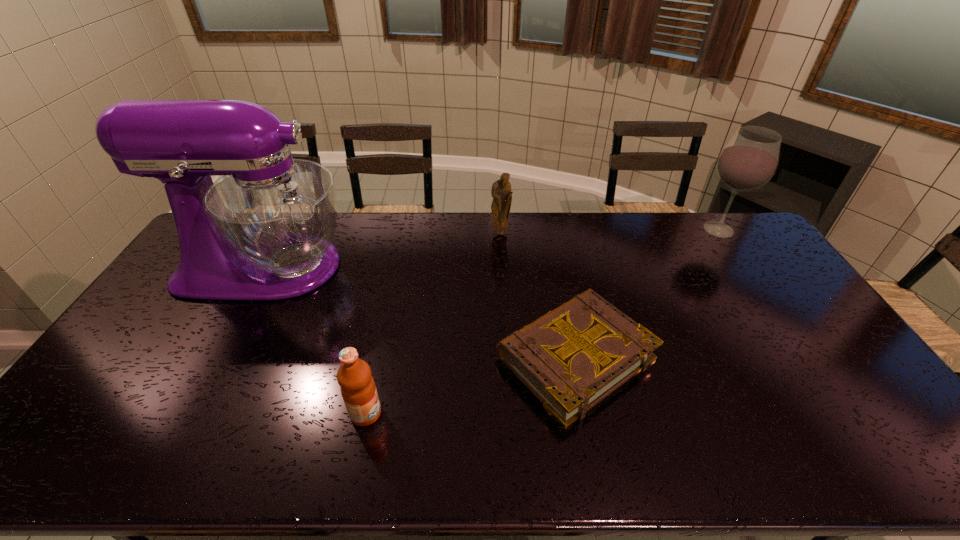
At what (x,y) coordinates should I click in order to perform the action: click on vacant point located between the alcohol and the figurine. Please return your answer as a coordinate pair (x, y). Looking at the image, I should click on (610, 232).

This screenshot has height=540, width=960. Find the location of `free space between the figurine and the hardback book`. free space between the figurine and the hardback book is located at coordinates (538, 295).

Identify which object is the third nearest to the fruit juice. Please provide its 2D coordinates. Your answer should be formatted as a tuple, i.e. [(x, y)], where the tuple contains the x and y coordinates of a point satisfying the conditions above.

[(501, 192)]

Find the location of a particular element. The width and height of the screenshot is (960, 540). object that is the closest to the leftmost object is located at coordinates (358, 389).

Find the location of a particular element. Image resolution: width=960 pixels, height=540 pixels. vacant region that satisfies the following two spatial constraints: 1. on the front-facing side of the hardback book; 2. on the left side of the figurine is located at coordinates (508, 357).

The image size is (960, 540). I want to click on free location that satisfies the following two spatial constraints: 1. at the bowl opening of the shortest object; 2. on the left side of the leftmost object, so click(216, 357).

The width and height of the screenshot is (960, 540). I want to click on vacant space that satisfies the following two spatial constraints: 1. on the front-facing side of the figurine; 2. on the left side of the shortest object, so click(508, 357).

Where is `vacant space that satisfies the following two spatial constraints: 1. on the front-facing side of the figurine; 2. at the bowl opening of the leftmost object`? The width and height of the screenshot is (960, 540). vacant space that satisfies the following two spatial constraints: 1. on the front-facing side of the figurine; 2. at the bowl opening of the leftmost object is located at coordinates (502, 267).

Identify the location of free space that satisfies the following two spatial constraints: 1. at the bowl opening of the mixer; 2. on the right side of the shortest object. The height and width of the screenshot is (540, 960). (216, 357).